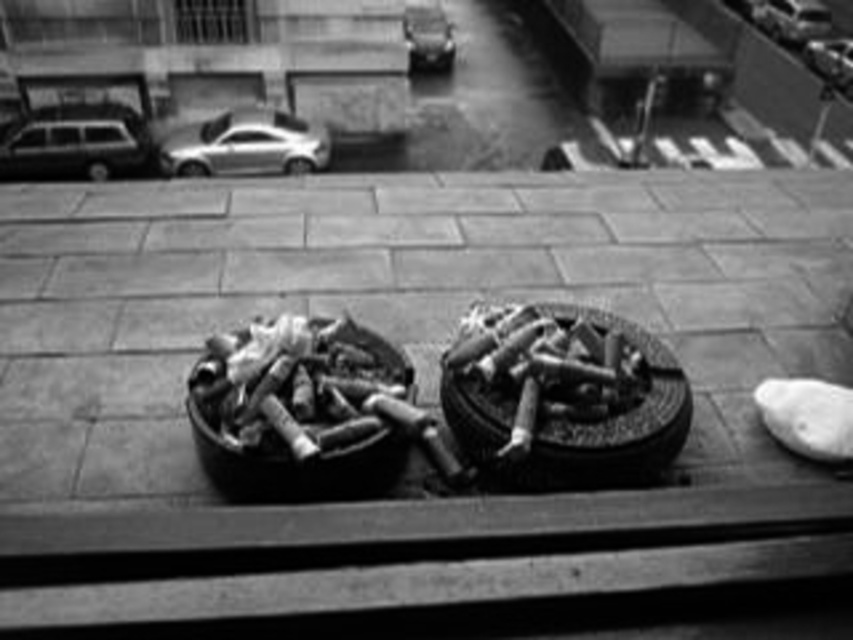
You are a delivery person trying to park your vehicle on this rooftop. You see the metallic silver van at left and the metallic silver car at upper center. Which vehicle is closer to the edge of the rooftop?

The metallic silver van at left is located below the metallic silver car at upper center, so it is closer to the edge of the rooftop.

You are a delivery driver who needs to park your truck between the shiny silver sedan at upper center and the metallic silver van at left. Given that your truck is 2.5 meters wide, can you fit it in the space between them?

The shiny silver sedan at upper center is wider than the metallic silver van at left. However, the exact width of the space between them isn t provided in the scene description. Without knowing the distance between the two vehicles, it s impossible to determine if the truck will fit. Please check the actual space or obtain more details about their positioning.